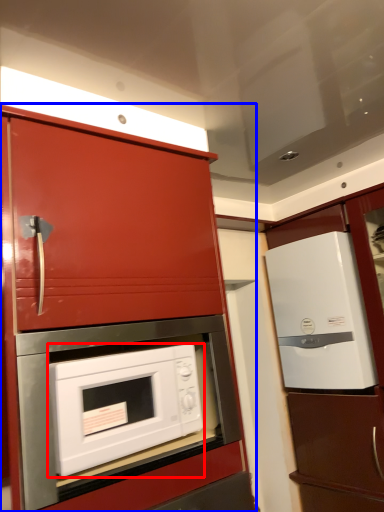
Question: Which object appears closest to the camera in this image, microwave oven (highlighted by a red box) or cabinetry (highlighted by a blue box)?

Choices:
 (A) microwave oven
 (B) cabinetry

Answer: (B)